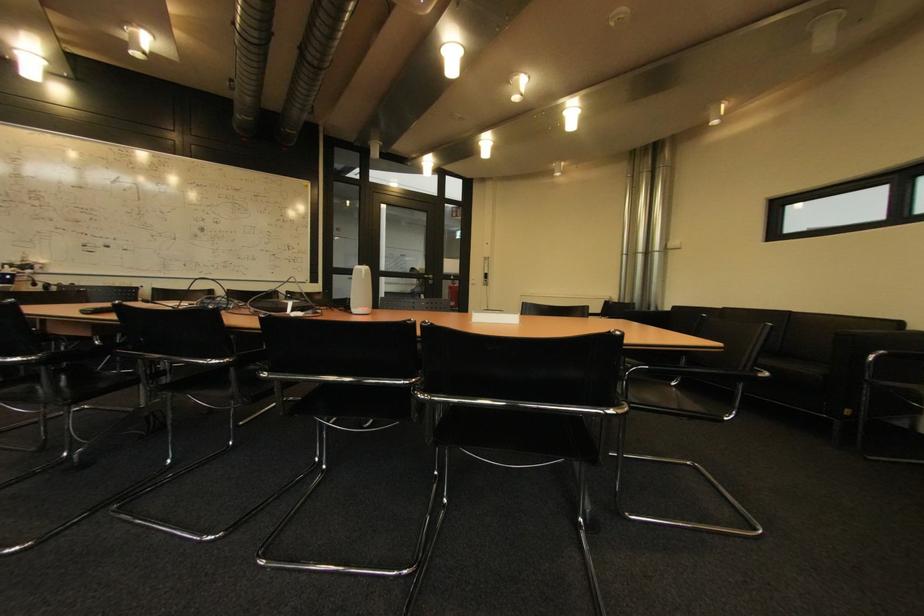
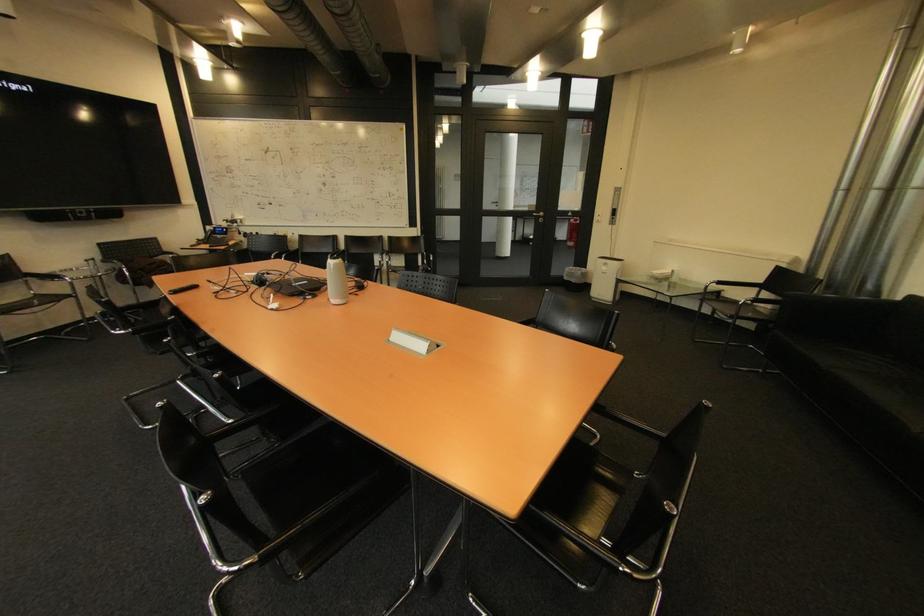
Find the pixel in the second image that matches point 432,274 in the first image.

(542, 209)